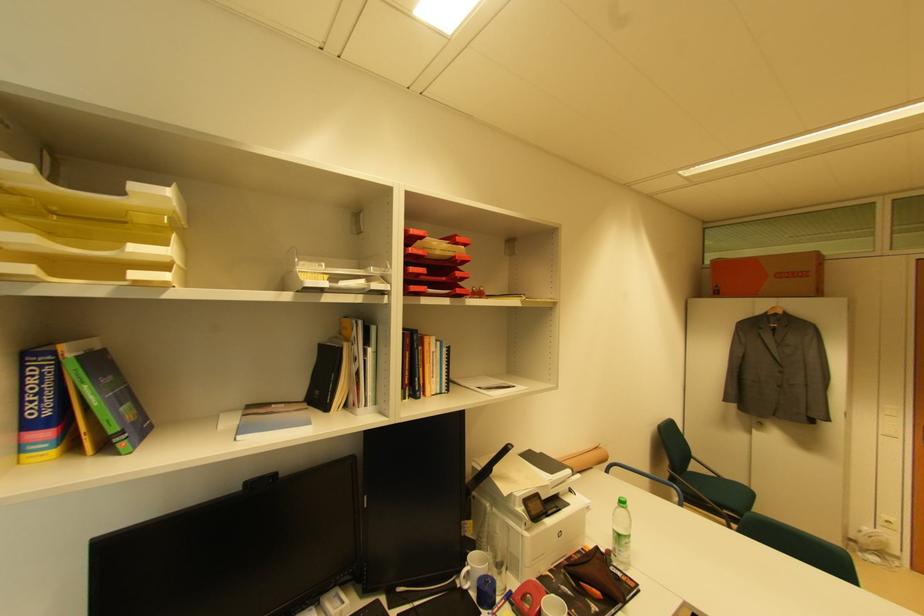
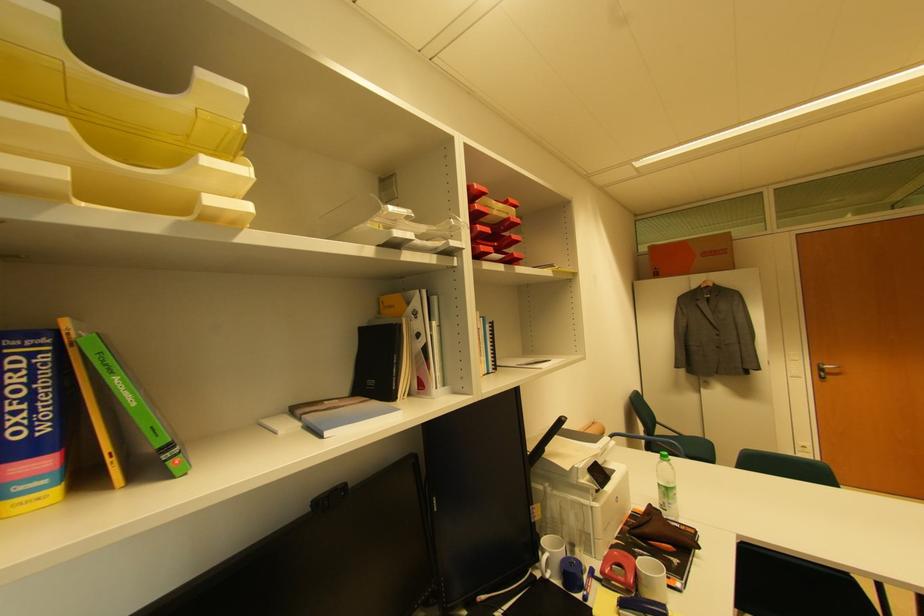
Question: How did the camera likely rotate?

Choices:
 (A) Left
 (B) Right
 (C) Up
 (D) Down

Answer: (B)